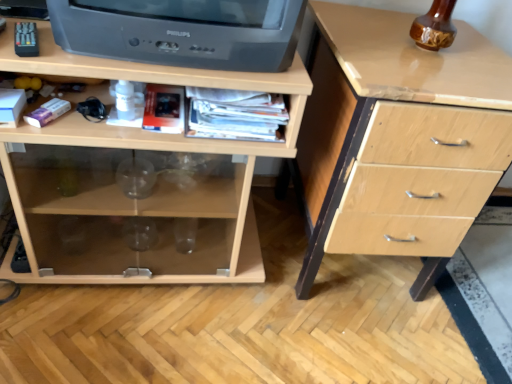
Question: Is black plastic television at upper left located outside light wood chest of drawers at center, arranged as the first chest of drawers when viewed from the left?

Choices:
 (A) yes
 (B) no

Answer: (A)

Question: Is light wood chest of drawers at center, arranged as the 2th chest of drawers when viewed from the right, surrounded by black plastic television at upper left?

Choices:
 (A) yes
 (B) no

Answer: (B)

Question: Does black plastic television at upper left have a lesser height compared to light wood chest of drawers at center, arranged as the first chest of drawers when viewed from the left?

Choices:
 (A) no
 (B) yes

Answer: (B)

Question: From the image's perspective, would you say black plastic television at upper left is positioned over light wood chest of drawers at center, arranged as the 2th chest of drawers when viewed from the right?

Choices:
 (A) no
 (B) yes

Answer: (B)

Question: From the image's perspective, is black plastic television at upper left located beneath light wood chest of drawers at center, arranged as the first chest of drawers when viewed from the left?

Choices:
 (A) no
 (B) yes

Answer: (A)

Question: From a real-world perspective, is black plastic television at upper left on top of light wood chest of drawers at center, arranged as the first chest of drawers when viewed from the left?

Choices:
 (A) yes
 (B) no

Answer: (A)

Question: Would you say light wood chest of drawers at right, which is the 1th chest of drawers from right to left, is a long distance from light wood chest of drawers at center, arranged as the first chest of drawers when viewed from the left?

Choices:
 (A) yes
 (B) no

Answer: (B)

Question: Can you confirm if light wood chest of drawers at right, which is the 1th chest of drawers from right to left, is thinner than light wood chest of drawers at center, arranged as the 2th chest of drawers when viewed from the right?

Choices:
 (A) no
 (B) yes

Answer: (A)

Question: Can we say light wood chest of drawers at right, which is the 1th chest of drawers from right to left, lies outside light wood chest of drawers at center, arranged as the first chest of drawers when viewed from the left?

Choices:
 (A) yes
 (B) no

Answer: (A)

Question: From a real-world perspective, is light wood chest of drawers at right, which is the 1th chest of drawers from right to left, located higher than light wood chest of drawers at center, arranged as the 2th chest of drawers when viewed from the right?

Choices:
 (A) no
 (B) yes

Answer: (B)

Question: From the image's perspective, is light wood chest of drawers at right, the 2th chest of drawers viewed from the left, under light wood chest of drawers at center, arranged as the first chest of drawers when viewed from the left?

Choices:
 (A) yes
 (B) no

Answer: (A)

Question: Is light wood chest of drawers at right, which is the 1th chest of drawers from right to left, turned away from light wood chest of drawers at center, arranged as the first chest of drawers when viewed from the left?

Choices:
 (A) no
 (B) yes

Answer: (A)

Question: Is black plastic television at upper left smaller than light wood chest of drawers at right, which is the 1th chest of drawers from right to left?

Choices:
 (A) yes
 (B) no

Answer: (A)